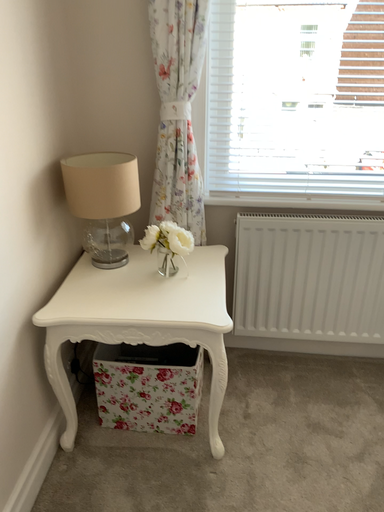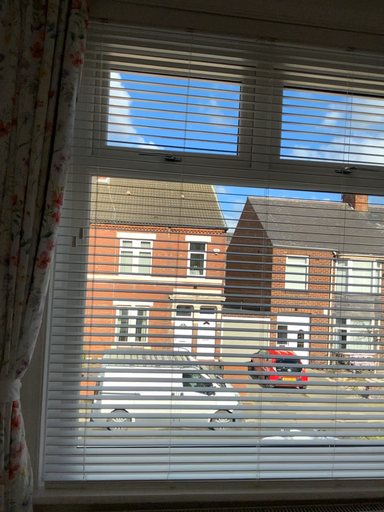
Question: How did the camera likely rotate when shooting the video?

Choices:
 (A) rotated downward
 (B) rotated upward

Answer: (B)